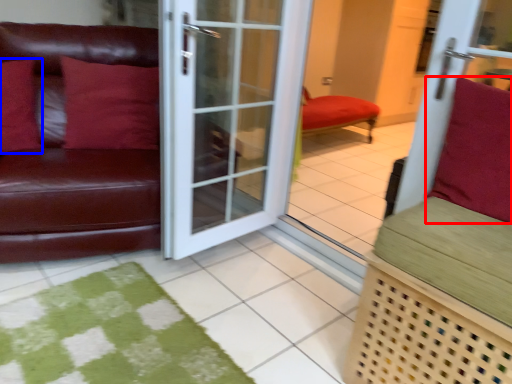
Question: Which object appears farthest to the camera in this image, pillow (highlighted by a red box) or pillow (highlighted by a blue box)?

Choices:
 (A) pillow
 (B) pillow

Answer: (B)